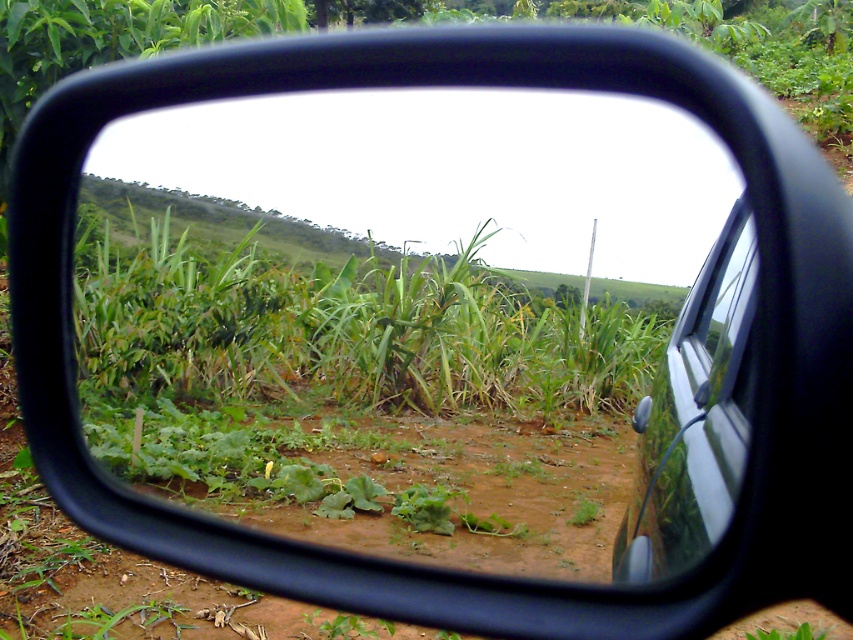
You are driving a car and looking at the side mirror. You see a point marked at coordinates (343,321). What is located at that point in the mirror?

At point (343,321) lies green leafy corn field at center.